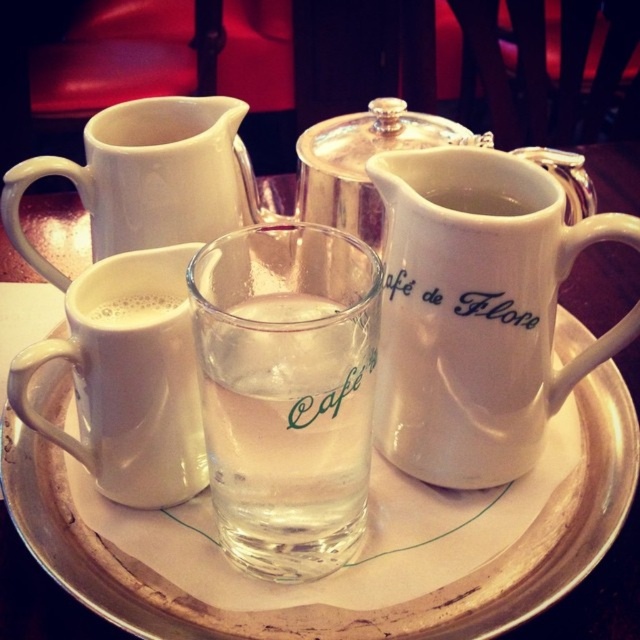
Question: Among these objects, which one is farthest from the camera?

Choices:
 (A) white ceramic pitcher at right
 (B) white matte mug at upper left
 (C) white frothy coffee at upper left

Answer: (B)

Question: Which is farther from the white frothy coffee at upper left?

Choices:
 (A) white matte mug at upper left
 (B) white ceramic pitcher at upper center
 (C) white ceramic pitcher at right
 (D) white ceramic plate at center

Answer: (B)

Question: Which object is the closest to the clear glass water at center?

Choices:
 (A) white matte mug at upper left
 (B) white frothy coffee at upper left
 (C) white ceramic pitcher at right
 (D) white matte mug at left

Answer: (D)

Question: Can you confirm if clear glass water at center is bigger than white ceramic pitcher at upper center?

Choices:
 (A) no
 (B) yes

Answer: (B)

Question: Does white ceramic plate at center have a smaller size compared to white ceramic pitcher at upper center?

Choices:
 (A) no
 (B) yes

Answer: (A)

Question: Does white matte mug at left appear on the left side of white ceramic pitcher at upper center?

Choices:
 (A) yes
 (B) no

Answer: (A)